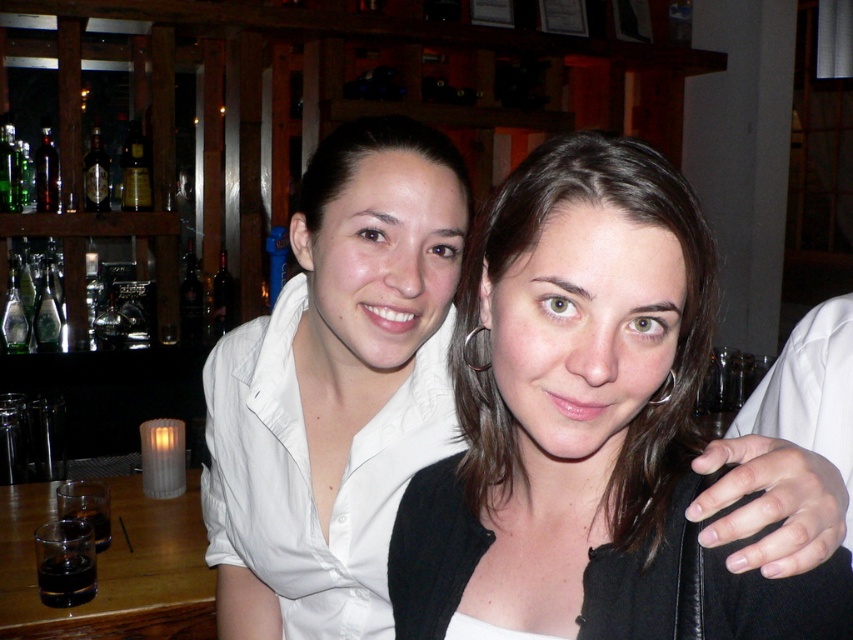
Question: Does matte black jacket at center appear under shiny gold bottle at upper left?

Choices:
 (A) no
 (B) yes

Answer: (B)

Question: Which object appears closest to the camera in this image?

Choices:
 (A) matte black jacket at center
 (B) white matte shirt at center

Answer: (A)

Question: Which point is closer to the camera?

Choices:
 (A) (637, 456)
 (B) (126, 150)

Answer: (A)

Question: Is white matte shirt at center above shiny gold bottle at upper left?

Choices:
 (A) no
 (B) yes

Answer: (A)

Question: Is the position of white matte shirt at center less distant than that of shiny gold bottle at upper left?

Choices:
 (A) yes
 (B) no

Answer: (A)

Question: Estimate the real-world distances between objects in this image. Which object is closer to the matte black jacket at center?

Choices:
 (A) shiny gold bottle at upper left
 (B) dark amber glass bottle at upper left

Answer: (A)